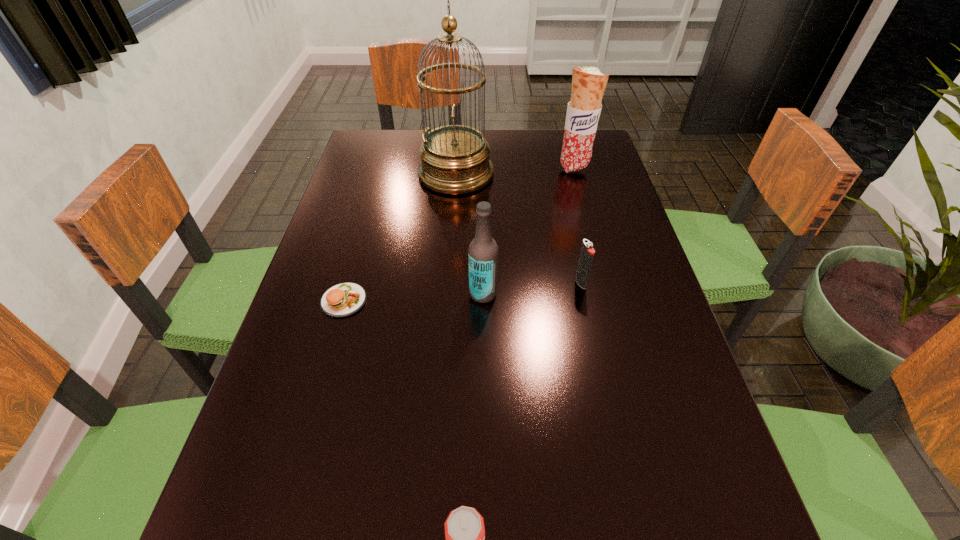
This screenshot has height=540, width=960. Find the location of `blank space located on the side of the fourth shortest object with the label`. blank space located on the side of the fourth shortest object with the label is located at coordinates (319, 293).

Image resolution: width=960 pixels, height=540 pixels. What are the coordinates of `free space located 0.100m on the back of the fourth tallest object` in the screenshot? It's located at (572, 246).

The width and height of the screenshot is (960, 540). I want to click on vacant space located on the front of the patty, so click(290, 491).

Where is `birdcage located at the far edge`? birdcage located at the far edge is located at coordinates (455, 159).

Find the location of a particular element. burrito at the far edge is located at coordinates (588, 84).

Find the location of `object that is at the left edge`. object that is at the left edge is located at coordinates tap(344, 299).

Find the location of a particular element. This screenshot has width=960, height=540. burrito located at the right edge is located at coordinates (588, 84).

Find the location of a particular element. This screenshot has width=960, height=540. igniter that is positioned at the right edge is located at coordinates (587, 253).

Find the location of `object located in the far right corner section of the desktop`. object located in the far right corner section of the desktop is located at coordinates (588, 84).

Locate an element on the screen. vacant space at the far edge is located at coordinates coord(503,151).